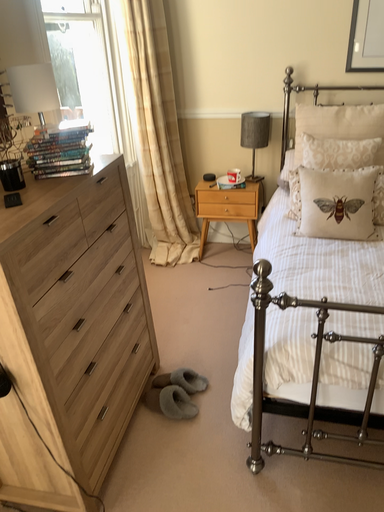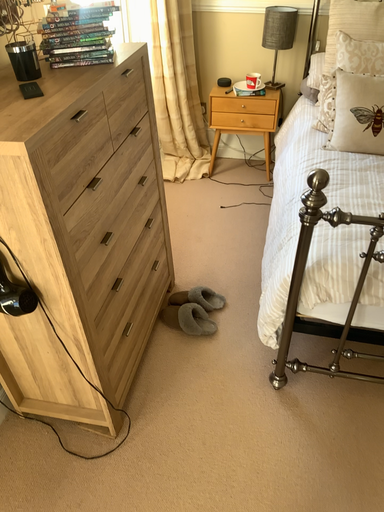
Question: How did the camera likely rotate when shooting the video?

Choices:
 (A) rotated upward
 (B) rotated downward

Answer: (B)